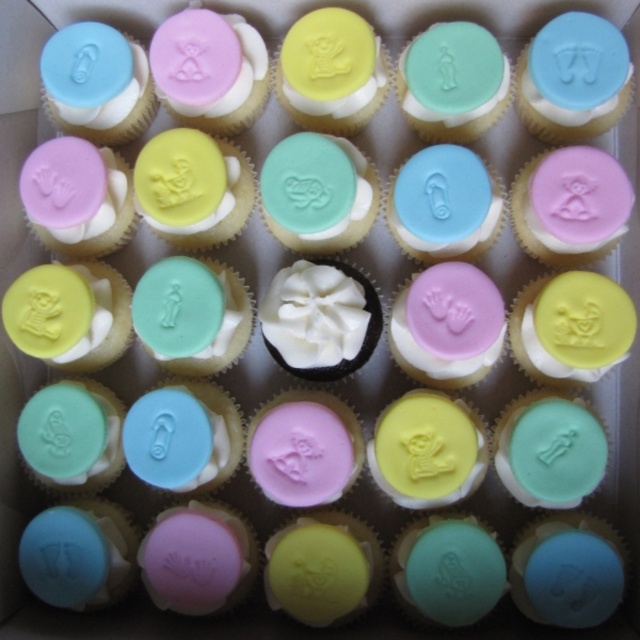
You are looking at the cupcakes in the box and notice two points marked on the cupcakes. The first point is at coordinate point (566, 112) and the second is at point (316, 346). Which point is closer to you?

Point (566, 112) is closer to the viewer than point (316, 346) because it is further to the viewer.